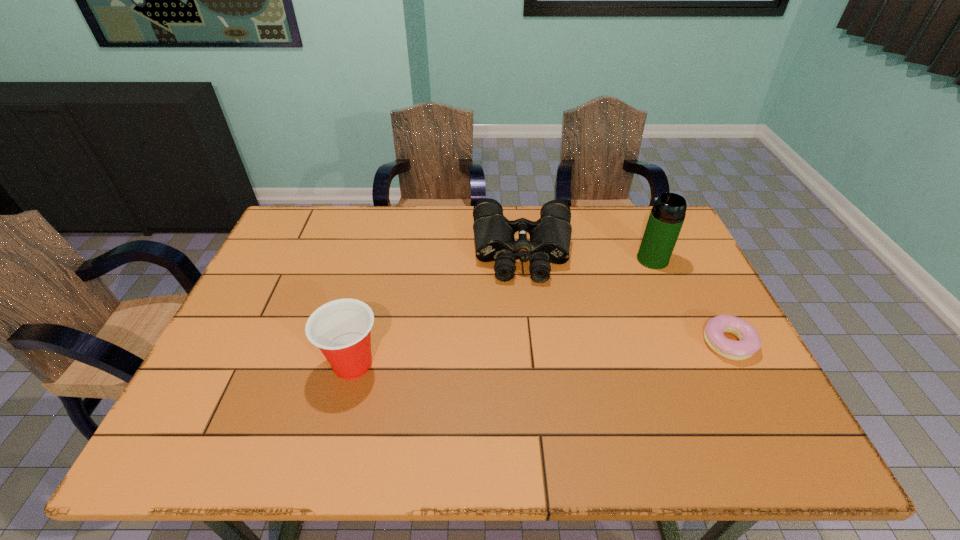
The width and height of the screenshot is (960, 540). What are the coordinates of `empty location between the doughnut and the second shortest object` in the screenshot? It's located at (626, 297).

What are the coordinates of `vacant area that lies between the shortest object and the tallest object` in the screenshot? It's located at (690, 301).

Where is `unoccupied position between the shortest object and the leftmost object`? unoccupied position between the shortest object and the leftmost object is located at coordinates (540, 354).

Locate an element on the screen. The image size is (960, 540). free spot between the shortest object and the leftmost object is located at coordinates (540, 354).

This screenshot has width=960, height=540. In order to click on free area in between the third shortest object and the second object from left to right in this screenshot , I will do `click(438, 308)`.

Locate which object is the third closest to the leftmost object. Please provide its 2D coordinates. Your answer should be formatted as a tuple, i.e. [(x, y)], where the tuple contains the x and y coordinates of a point satisfying the conditions above.

[(749, 342)]

You are a GUI agent. You are given a task and a screenshot of the screen. Output one action in this format:
    pyautogui.click(x=<x>, y=<y>)
    Task: Click on the closest object to the third shortest object
    
    Given the screenshot: What is the action you would take?
    pyautogui.click(x=550, y=236)

The image size is (960, 540). What are the coordinates of `vacant space that satisfies the following two spatial constraints: 1. on the front side of the second shortest object; 2. on the right side of the tallest object` in the screenshot? It's located at (524, 259).